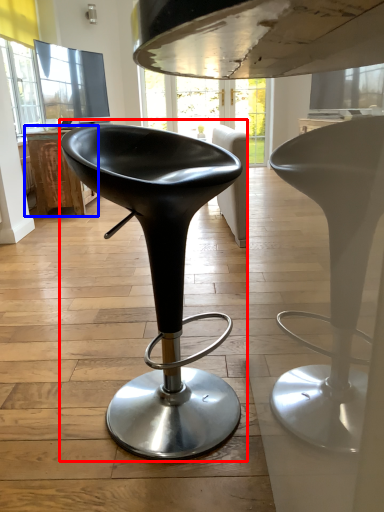
Question: Which object appears farthest to the camera in this image, chair (highlighted by a red box) or table (highlighted by a blue box)?

Choices:
 (A) chair
 (B) table

Answer: (B)